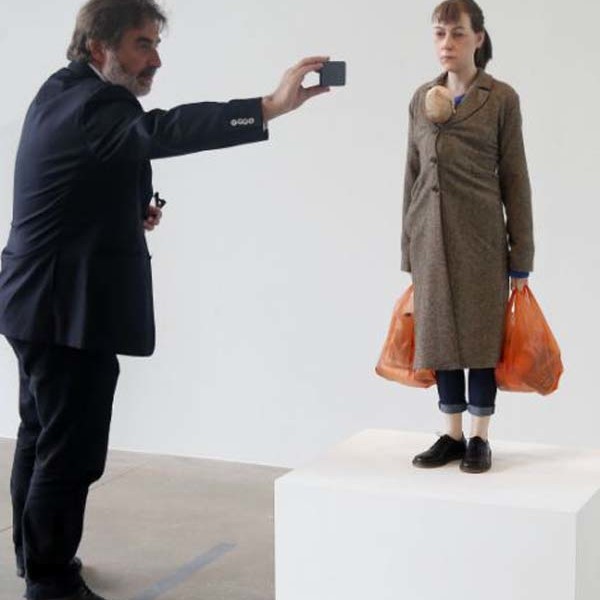
This screenshot has width=600, height=600. I want to click on wall, so click(331, 408).